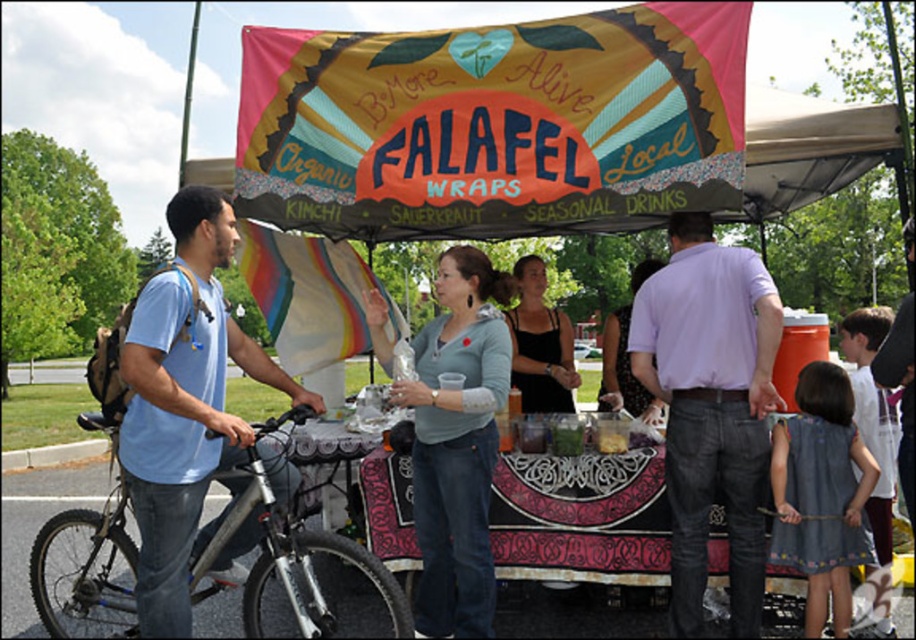
Question: Which object is closer to the camera taking this photo?

Choices:
 (A) light blue sweater at center
 (B) black tank top at center

Answer: (A)

Question: Observing the image, what is the correct spatial positioning of light purple shirt at center in reference to silver metallic bicycle at left?

Choices:
 (A) above
 (B) below

Answer: (A)

Question: Considering the real-world distances, which object is closest to the light purple shirt at center?

Choices:
 (A) matte black shirt at center
 (B) blue t-shirt at left

Answer: (A)

Question: Does blue t-shirt at left have a greater width compared to matte black shirt at center?

Choices:
 (A) no
 (B) yes

Answer: (A)

Question: Can you confirm if blue t-shirt at left is positioned below light blue sweater at center?

Choices:
 (A) yes
 (B) no

Answer: (B)

Question: Which object is positioned closest to the blue t-shirt at left?

Choices:
 (A) black tank top at center
 (B) silver metallic bicycle at left
 (C) light blue sweater at center

Answer: (B)